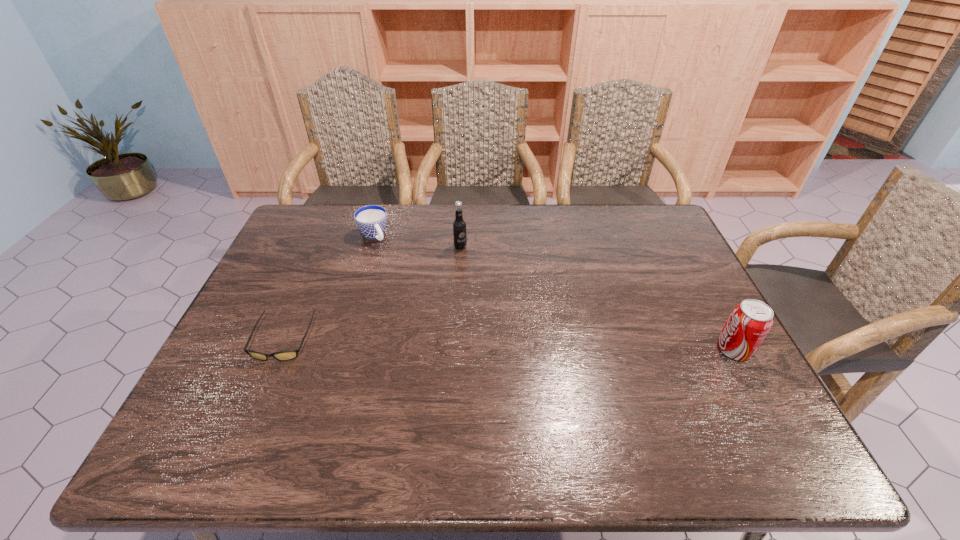
At what (x,y) coordinates should I click in order to perform the action: click on free space at the near edge of the desktop. Please return your answer as a coordinate pair (x, y). The width and height of the screenshot is (960, 540). Looking at the image, I should click on (579, 400).

In order to click on free region at the left edge of the desktop in this screenshot , I will do `click(288, 252)`.

This screenshot has height=540, width=960. Identify the location of vacant space at the right edge of the desktop. (692, 347).

Identify the location of free spot at the far left corner of the desktop. click(298, 237).

What are the coordinates of `vacant area at the far right corner of the desktop` in the screenshot? It's located at (630, 216).

Locate an element on the screen. free space that is in between the second object from left to right and the root beer is located at coordinates (417, 241).

Identify the location of free spot between the leftmost object and the second shortest object. This screenshot has width=960, height=540. (328, 288).

The width and height of the screenshot is (960, 540). I want to click on unoccupied position between the third tallest object and the sunglasses, so click(328, 288).

The image size is (960, 540). I want to click on free space between the second tallest object and the root beer, so click(597, 299).

This screenshot has width=960, height=540. I want to click on free space between the shortest object and the root beer, so click(372, 293).